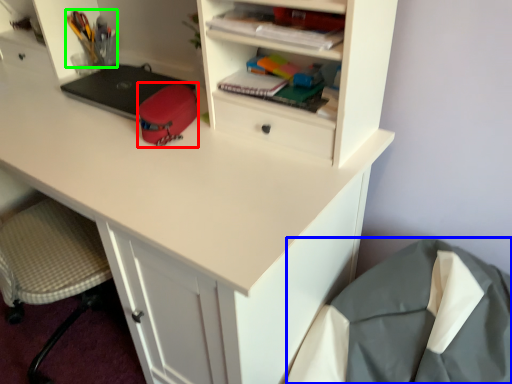
Question: Based on their relative distances, which object is farther from stationery (highlighted by a red box)? Choose from sleeping bag (highlighted by a blue box) and stationery (highlighted by a green box).

Choices:
 (A) sleeping bag
 (B) stationery

Answer: (A)